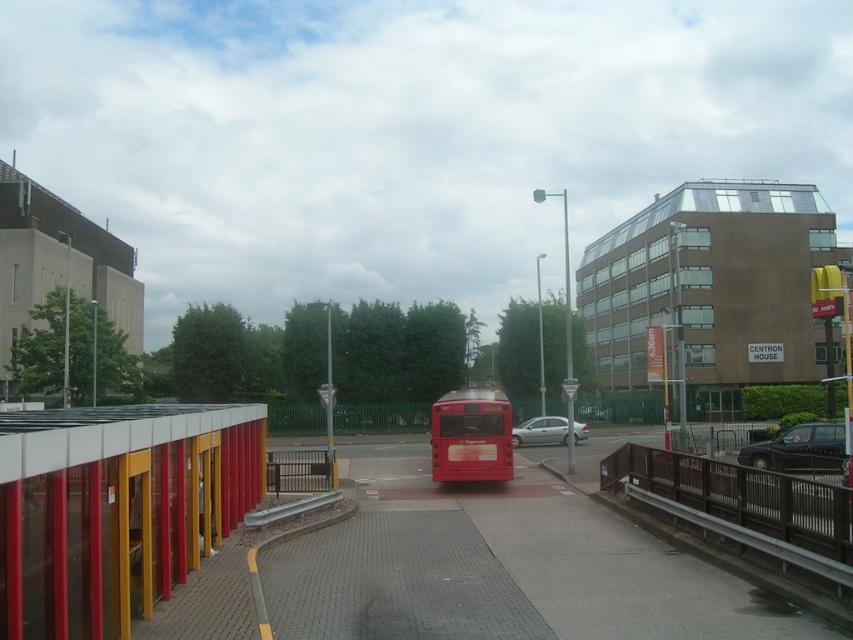
You are a pedestrian standing at the crosswalk near the shiny red bus at center and the black metallic car at lower right. Which vehicle is closer to you?

The shiny red bus at center is closer to you because the black metallic car at lower right is behind it.

In the scene shown: You are a pedestrian trying to cross the road. You see the metallic red bus stop at left and the black metallic car at lower right. Which object is closer to you?

The metallic red bus stop at left is closer to you because it is smaller than the black metallic car at lower right, indicating it is farther away.

You are a pedestrian standing at the crosswalk and want to cross the road to reach the black metallic car at lower right. Is the metallic red bus stop at left between you and the car?

Yes, the metallic red bus stop at left is between you and the black metallic car at lower right, so you would need to go around it to reach the car.